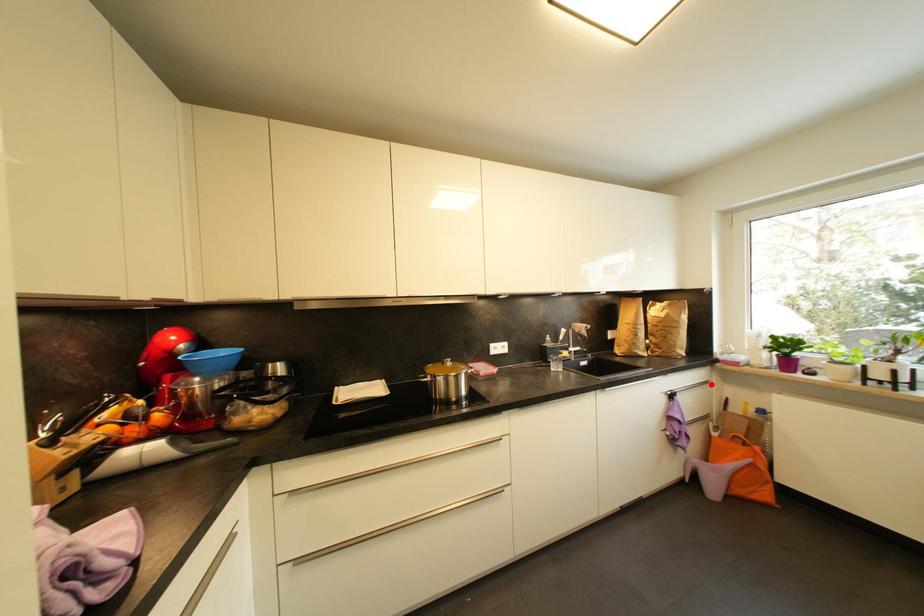
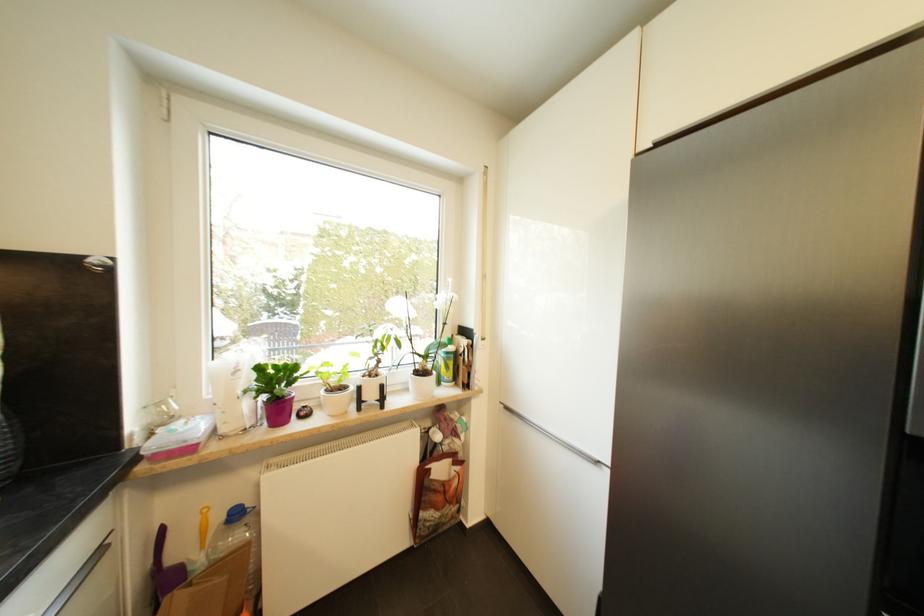
Question: I am providing you with two images of the same scene from different viewpoints. Image1 has a red point marked. In image2, the corresponding 3D location appears at what relative position? Reply with the corresponding letter.

Choices:
 (A) Closer
 (B) Farther

Answer: (B)